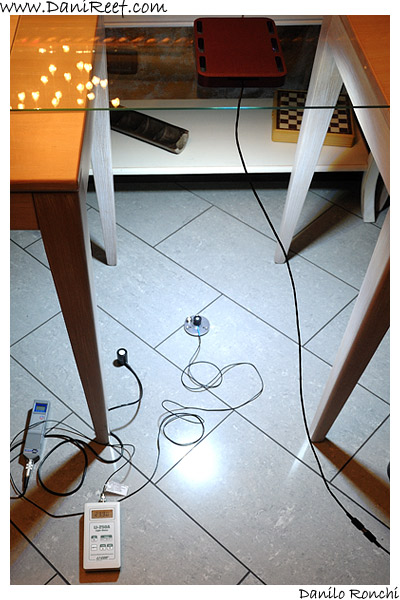
This screenshot has width=400, height=600. Identify the location of shadow from the table leg. (368, 487), (75, 470).